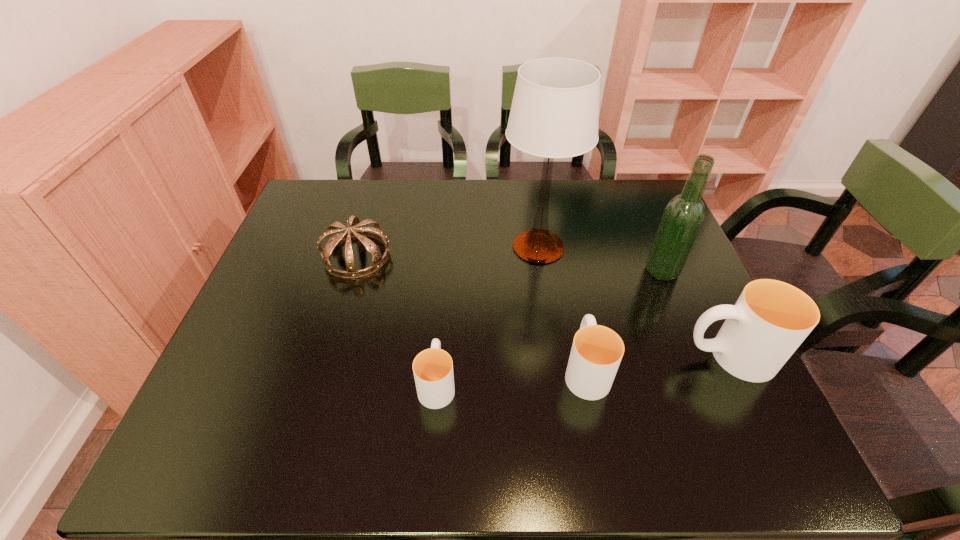
Choose which object is the fourth nearest neighbor to the tallest object. Please provide its 2D coordinates. Your answer should be formatted as a tuple, i.e. [(x, y)], where the tuple contains the x and y coordinates of a point satisfying the conditions above.

[(433, 368)]

The height and width of the screenshot is (540, 960). In order to click on object that is the third closest to the leftmost object in this screenshot , I will do [x=596, y=353].

Locate an element on the screen. Image resolution: width=960 pixels, height=540 pixels. cup that is the closest to the second tallest cup is located at coordinates (770, 320).

I want to click on cup that stands as the closest to the leftmost object, so click(433, 368).

You are a GUI agent. You are given a task and a screenshot of the screen. Output one action in this format:
    pyautogui.click(x=<x>, y=<y>)
    Task: Click on the vacant area in the image that satisfies the following two spatial constraints: 1. with the handle on the side of the leftmost cup; 2. with the handle on the side of the third tallest object
    This screenshot has height=540, width=960.
    Given the screenshot: What is the action you would take?
    pyautogui.click(x=439, y=356)

Identify the location of vacant space that satisfies the following two spatial constraints: 1. above the cylindrical shade of the table lamp; 2. with the handle on the side of the tallest cup. (554, 356).

The image size is (960, 540). Find the location of `free location that satisfies the following two spatial constraints: 1. above the cylindrical shade of the tallest object; 2. with the handle on the side of the rightmost cup`. free location that satisfies the following two spatial constraints: 1. above the cylindrical shade of the tallest object; 2. with the handle on the side of the rightmost cup is located at coordinates (554, 356).

This screenshot has width=960, height=540. I want to click on free region that satisfies the following two spatial constraints: 1. above the cylindrical shade of the tallest object; 2. with the handle on the side of the fourth shortest object, so click(554, 356).

This screenshot has height=540, width=960. I want to click on free space that satisfies the following two spatial constraints: 1. with the handle on the side of the tallest cup; 2. above the cylindrical shade of the tallest object, so click(x=676, y=247).

Identify the location of vacant space that satisfies the following two spatial constraints: 1. with the handle on the side of the fifth shortest object; 2. on the left side of the shortest object. (445, 271).